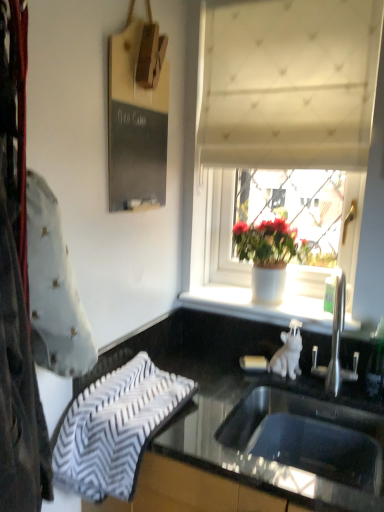
Image resolution: width=384 pixels, height=512 pixels. Describe the element at coordinates (135, 126) in the screenshot. I see `black chalkboard at upper left` at that location.

Measure the distance between white zigzag-patterned towel at lower left and camera.

They are 3.32 feet apart.

What do you see at coordinates (115, 428) in the screenshot?
I see `white zigzag-patterned towel at lower left` at bounding box center [115, 428].

Describe the element at coordinates (290, 84) in the screenshot. The width and height of the screenshot is (384, 512). I see `white textured curtain at upper center` at that location.

What is the approximate height of black glossy countertop at lower center?

The height of black glossy countertop at lower center is 80.80 centimeters.

Locate an element on the screen. The width and height of the screenshot is (384, 512). white matte pot at center is located at coordinates (268, 256).

Which point is more forward, [344,454] or [98,419]?

The point [98,419] is closer.

Is the position of stainless steel sink at lower center more distant than that of white zigzag-patterned towel at lower left?

No, stainless steel sink at lower center is in front of white zigzag-patterned towel at lower left.

Where is `beach towel on the left side of stainless steel sink at lower center`? beach towel on the left side of stainless steel sink at lower center is located at coordinates (115, 428).

From the picture: From the image's perspective, is stainless steel sink at lower center below white zigzag-patterned towel at lower left?

Yes, from the image's perspective, stainless steel sink at lower center is beneath white zigzag-patterned towel at lower left.

The image size is (384, 512). What are the coordinates of `bulletin board lying above the white textured curtain at upper center (from the image's perspective)` in the screenshot? It's located at (135, 126).

Considering the sizes of objects white textured curtain at upper center and black chalkboard at upper left in the image provided, who is shorter, white textured curtain at upper center or black chalkboard at upper left?

Standing shorter between the two is black chalkboard at upper left.

Is white textured curtain at upper center looking in the opposite direction of black chalkboard at upper left?

No, white textured curtain at upper center is not facing the opposite direction of black chalkboard at upper left.

From a real-world perspective, is white textured curtain at upper center beneath white textured curtain at upper center?

No, from a real-world perspective, white textured curtain at upper center is not below white textured curtain at upper center.

The height and width of the screenshot is (512, 384). In order to click on curtain that appears in front of the white textured curtain at upper center in this screenshot , I will do `click(290, 84)`.

Is white textured curtain at upper center shorter than white textured curtain at upper center?

Correct, white textured curtain at upper center is not as tall as white textured curtain at upper center.

Does white textured curtain at upper center have a smaller size compared to white textured curtain at upper center?

Indeed, white textured curtain at upper center has a smaller size compared to white textured curtain at upper center.

Which is in front, point (221, 201) or point (263, 400)?

The point (263, 400) is closer to the camera.

Considering the relative sizes of white textured curtain at upper center and stainless steel sink at lower center in the image provided, is white textured curtain at upper center smaller than stainless steel sink at lower center?

No.

Can you confirm if white textured curtain at upper center is wider than stainless steel sink at lower center?

No, white textured curtain at upper center is not wider than stainless steel sink at lower center.

Which is more to the right, white textured curtain at upper center or stainless steel sink at lower center?

From the viewer's perspective, white textured curtain at upper center appears more on the right side.

From the image's perspective, is white zigzag-patterned towel at lower left below stainless steel sink at lower center?

Incorrect, from the image's perspective, white zigzag-patterned towel at lower left is higher than stainless steel sink at lower center.

The height and width of the screenshot is (512, 384). I want to click on beach towel above the stainless steel sink at lower center (from a real-world perspective), so click(115, 428).

Is white zigzag-patterned towel at lower left wider than stainless steel sink at lower center?

Correct, the width of white zigzag-patterned towel at lower left exceeds that of stainless steel sink at lower center.

Who is smaller, white zigzag-patterned towel at lower left or stainless steel sink at lower center?

With smaller size is white zigzag-patterned towel at lower left.

Is white textured curtain at upper center in front of black chalkboard at upper left?

No, white textured curtain at upper center is further to the viewer.

Can you tell me how much white textured curtain at upper center and black chalkboard at upper left differ in facing direction?

white textured curtain at upper center and black chalkboard at upper left are facing 89.9 degrees away from each other.

From a real-world perspective, is white textured curtain at upper center positioned over black chalkboard at upper left based on gravity?

Yes, from a real-world perspective, white textured curtain at upper center is over black chalkboard at upper left

Which is in front, point (301, 0) or point (113, 68)?

Positioned in front is point (113, 68).

Does white textured curtain at upper center have a lesser height compared to white zigzag-patterned towel at lower left?

No.

Based on the photo, from a real-world perspective, does white textured curtain at upper center stand above white zigzag-patterned towel at lower left?

Correct, in the physical world, white textured curtain at upper center is higher than white zigzag-patterned towel at lower left.

Can you tell me how much white textured curtain at upper center and white zigzag-patterned towel at lower left differ in facing direction?

There is a 0.775-degree angle between the facing directions of white textured curtain at upper center and white zigzag-patterned towel at lower left.

Visually, is white textured curtain at upper center positioned to the left or to the right of white zigzag-patterned towel at lower left?

From the image, it's evident that white textured curtain at upper center is to the right of white zigzag-patterned towel at lower left.

Locate an element on the screen. The height and width of the screenshot is (512, 384). beach towel lying behind the stainless steel sink at lower center is located at coordinates (115, 428).

I want to click on window below the black chalkboard at upper left (from a real-world perspective), so click(x=294, y=166).

From the image, which object appears to be farther from black glossy countertop at lower center, white textured curtain at upper center or black chalkboard at upper left?

white textured curtain at upper center is further to black glossy countertop at lower center.

Consider the image. From the image, which object appears to be farther from white matte pot at center, stainless steel sink at lower center or black glossy countertop at lower center?

Among the two, stainless steel sink at lower center is located further to white matte pot at center.

Which object lies further to the anchor point white zigzag-patterned towel at lower left, black glossy countertop at lower center or white textured curtain at upper center?

white textured curtain at upper center is positioned further to the anchor white zigzag-patterned towel at lower left.

Considering their positions, is white textured curtain at upper center positioned further to white textured curtain at upper center than black glossy countertop at lower center?

black glossy countertop at lower center lies further to white textured curtain at upper center than the other object.

From the image, which object appears to be nearer to stainless steel sink at lower center, white zigzag-patterned towel at lower left or white textured curtain at upper center?

white zigzag-patterned towel at lower left is closer to stainless steel sink at lower center.

Estimate the real-world distances between objects in this image. Which object is closer to white textured curtain at upper center, white zigzag-patterned towel at lower left or white textured curtain at upper center?

The object closer to white textured curtain at upper center is white textured curtain at upper center.

From the picture: Considering their positions, is white matte pot at center positioned closer to black glossy countertop at lower center than white zigzag-patterned towel at lower left?

The object closer to black glossy countertop at lower center is white zigzag-patterned towel at lower left.

Estimate the real-world distances between objects in this image. Which object is further from white matte pot at center, black glossy countertop at lower center or white textured curtain at upper center?

white textured curtain at upper center.

Where is `houseplant between black chalkboard at upper left and black glossy countertop at lower center in the vertical direction`? houseplant between black chalkboard at upper left and black glossy countertop at lower center in the vertical direction is located at coordinates (268, 256).

In order to click on sink between white textured curtain at upper center and black glossy countertop at lower center in the vertical direction in this screenshot , I will do `click(309, 436)`.

Where is `window between black chalkboard at upper left and black glossy countertop at lower center in the vertical direction`? The image size is (384, 512). window between black chalkboard at upper left and black glossy countertop at lower center in the vertical direction is located at coordinates (294, 166).

The image size is (384, 512). I want to click on countertop located between white zigzag-patterned towel at lower left and stainless steel sink at lower center in the left-right direction, so click(247, 420).